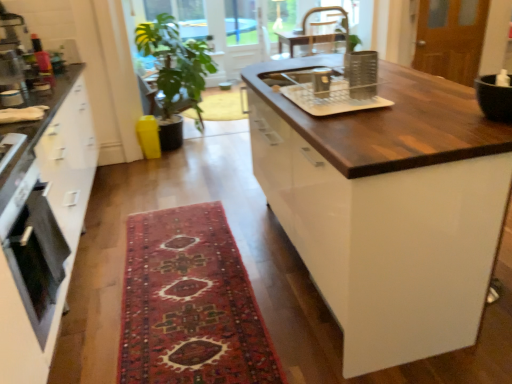
In order to click on metallic silver pot at upper center, the 3th appliance when ordered from right to left in this screenshot , I will do pos(321,82).

Identify the location of metallic silver toaster at left, the 4th appliance from the right. (12, 80).

The image size is (512, 384). What do you see at coordinates (34, 252) in the screenshot?
I see `matte black oven at left` at bounding box center [34, 252].

What do you see at coordinates (181, 15) in the screenshot? I see `green leafy plant at upper center` at bounding box center [181, 15].

What is the approximate width of green leafy plant at upper center?

It is 11.87 inches.

Identify the location of carpeted rug at center. (190, 304).

Where is `clear plastic dish rack at center, the third appliance positioned from the left`? Image resolution: width=512 pixels, height=384 pixels. clear plastic dish rack at center, the third appliance positioned from the left is located at coordinates (331, 97).

Is dark wood countertop at center located within black glossy bowl at upper right, the 4th appliance positioned from the left?

That's incorrect, dark wood countertop at center is not inside black glossy bowl at upper right, the 4th appliance positioned from the left.

Considering the sizes of black glossy bowl at upper right, which is the fourth appliance in back-to-front order, and dark wood countertop at center in the image, is black glossy bowl at upper right, which is the fourth appliance in back-to-front order, bigger or smaller than dark wood countertop at center?

Considering their sizes, black glossy bowl at upper right, which is the fourth appliance in back-to-front order, takes up less space than dark wood countertop at center.

Looking at this image, in terms of width, does black glossy bowl at upper right, the 1th appliance in the right-to-left sequence, look wider or thinner when compared to dark wood countertop at center?

Considering their sizes, black glossy bowl at upper right, the 1th appliance in the right-to-left sequence, looks slimmer than dark wood countertop at center.

Measure the distance between matte black oven at left and wooden screen door at upper right.

matte black oven at left and wooden screen door at upper right are 3.77 meters apart from each other.

Between matte black oven at left and wooden screen door at upper right, which one is positioned in front?

matte black oven at left is more forward.

Does matte black oven at left touch wooden screen door at upper right?

matte black oven at left is not next to wooden screen door at upper right, and they're not touching.

Is matte black oven at left positioned with its back to metallic silver toaster at left, the 4th appliance from the right?

matte black oven at left is not turned away from metallic silver toaster at left, the 4th appliance from the right.

From the image's perspective, is matte black oven at left above metallic silver toaster at left, which appears as the first appliance when viewed from the back?

No, from the image's perspective, matte black oven at left is not above metallic silver toaster at left, which appears as the first appliance when viewed from the back.

In terms of height, does matte black oven at left look taller or shorter compared to metallic silver toaster at left, which appears as the first appliance when viewed from the back?

matte black oven at left is taller than metallic silver toaster at left, which appears as the first appliance when viewed from the back.

Can you tell me how much matte black oven at left and metallic silver toaster at left, the 4th appliance from the right, differ in facing direction?

1.08 degrees separate the facing orientations of matte black oven at left and metallic silver toaster at left, the 4th appliance from the right.

How many degrees apart are the facing directions of metallic silver pot at upper center, the 2th appliance when ordered from left to right, and matte black oven at left?

The angular difference between metallic silver pot at upper center, the 2th appliance when ordered from left to right, and matte black oven at left is 93 degrees.

Which object is closer to the camera taking this photo, metallic silver pot at upper center, the 2th appliance when ordered from left to right, or matte black oven at left?

matte black oven at left.

Looking at this image, which is correct: metallic silver pot at upper center, the 2th appliance when ordered from left to right, is inside matte black oven at left, or outside of it?

metallic silver pot at upper center, the 2th appliance when ordered from left to right, cannot be found inside matte black oven at left.

Find the location of a particular element. This screenshot has height=384, width=512. window screen on the left of wooden screen door at upper right is located at coordinates (181, 15).

Is point (458, 4) farther from camera compared to point (190, 0)?

That is False.

Would you say green leafy plant at upper center is part of wooden screen door at upper right's contents?

No, green leafy plant at upper center is not surrounded by wooden screen door at upper right.

From the image's perspective, relative to green leafy plant at upper center, is wooden screen door at upper right above or below?

wooden screen door at upper right is situated lower than green leafy plant at upper center in the image.

Looking at this image, does black glossy bowl at upper right, the 1th appliance in the right-to-left sequence, have a smaller size compared to clear plastic dish rack at center, the 2th appliance positioned from the right?

Indeed, black glossy bowl at upper right, the 1th appliance in the right-to-left sequence, has a smaller size compared to clear plastic dish rack at center, the 2th appliance positioned from the right.

The image size is (512, 384). Find the location of `appliance located underneath the black glossy bowl at upper right, the 1th appliance in the right-to-left sequence (from a real-world perspective)`. appliance located underneath the black glossy bowl at upper right, the 1th appliance in the right-to-left sequence (from a real-world perspective) is located at coordinates (331, 97).

Which is further, (x=494, y=93) or (x=333, y=113)?

The point (x=333, y=113) is more distant.

Is green leafy plant at upper center positioned beyond the bounds of carpeted rug at center?

green leafy plant at upper center lies outside carpeted rug at center's area.

Which object is further away from the camera, green leafy plant at upper center or carpeted rug at center?

green leafy plant at upper center is further from the camera.

From a real-world perspective, is green leafy plant at upper center located beneath carpeted rug at center?

No, from a real-world perspective, green leafy plant at upper center is not under carpeted rug at center.

From the image's perspective, is green leafy plant at upper center positioned above or below carpeted rug at center?

Clearly, from the image's perspective, green leafy plant at upper center is above carpeted rug at center.

Identify the location of appliance on the right of dark wood countertop at center. This screenshot has width=512, height=384. (494, 99).

Image resolution: width=512 pixels, height=384 pixels. I want to click on screen door above the matte black oven at left (from a real-world perspective), so click(x=450, y=38).

Based on their spatial positions, is black glossy bowl at upper right, the 1th appliance when ordered from front to back, or carpeted rug at center closer to green leafy plant at center?

Among the two, carpeted rug at center is located nearer to green leafy plant at center.

Consider the image. Estimate the real-world distances between objects in this image. Which object is further from carpeted rug at center, wooden screen door at upper right or green leafy plant at center?

Among the two, wooden screen door at upper right is located further to carpeted rug at center.

From the image, which object appears to be nearer to dark wood countertop at center, carpeted rug at center or metallic silver pot at upper center, the 2th appliance when ordered from left to right?

The object closer to dark wood countertop at center is metallic silver pot at upper center, the 2th appliance when ordered from left to right.

Which object lies further to the anchor point clear plastic dish rack at center, which appears as the second appliance when viewed from the front, metallic silver pot at upper center, which ranks as the third appliance in front-to-back order, or carpeted rug at center?

The object further to clear plastic dish rack at center, which appears as the second appliance when viewed from the front, is carpeted rug at center.

Considering their positions, is metallic silver pot at upper center, the 3th appliance when ordered from right to left, positioned closer to metallic silver chair at upper center than matte black oven at left?

Among the two, metallic silver pot at upper center, the 3th appliance when ordered from right to left, is located nearer to metallic silver chair at upper center.

From the image, which object appears to be nearer to metallic silver chair at upper center, metallic silver toaster at left, which is the 4th appliance in front-to-back order, or metallic silver pot at upper center, which ranks as the third appliance in front-to-back order?

Based on the image, metallic silver pot at upper center, which ranks as the third appliance in front-to-back order, appears to be nearer to metallic silver chair at upper center.

From the picture: Looking at the image, which one is located further to carpeted rug at center, wooden screen door at upper right or green leafy plant at upper center?

green leafy plant at upper center is further to carpeted rug at center.

Estimate the real-world distances between objects in this image. Which object is further from green leafy plant at upper center, carpeted rug at center or metallic silver chair at upper center?

Based on the image, carpeted rug at center appears to be further to green leafy plant at upper center.

Find the location of a particular element. houseplant situated between metallic silver toaster at left, which is the 4th appliance in front-to-back order, and metallic silver chair at upper center from left to right is located at coordinates (175, 74).

In order to click on screen door positioned between metallic silver chair at upper center and green leafy plant at upper center from near to far in this screenshot , I will do `click(450, 38)`.

The height and width of the screenshot is (384, 512). Identify the location of appliance between clear plastic dish rack at center, which appears as the second appliance when viewed from the front, and metallic silver chair at upper center from front to back. (321, 82).

Identify the location of chair between dark wood countertop at center and wooden screen door at upper right from front to back. (325, 11).